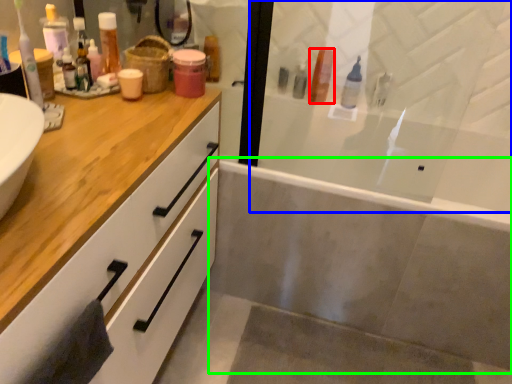
Question: Which object is the farthest from toiletry (highlighted by a red box)? Choose among these: screen door (highlighted by a blue box) or bath (highlighted by a green box).

Choices:
 (A) screen door
 (B) bath

Answer: (B)